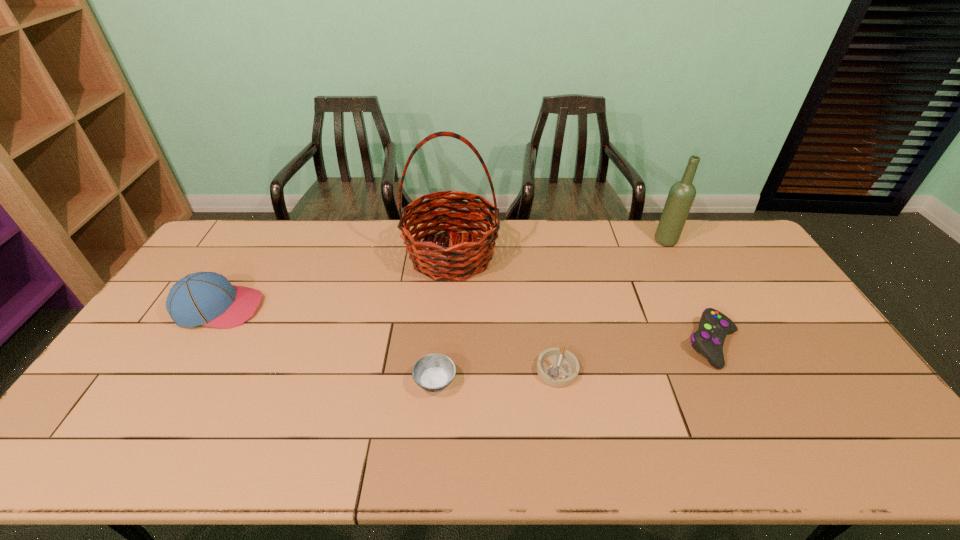
This screenshot has width=960, height=540. I want to click on free space located 0.170m on the front of the fifth shortest object, so click(686, 280).

In order to click on free space located 0.190m on the front-facing side of the fourth shortest object in this screenshot , I will do `click(323, 308)`.

The image size is (960, 540). In order to click on vacant space located on the right of the fourth tallest object in this screenshot , I will do `click(800, 344)`.

This screenshot has height=540, width=960. Identify the location of vacant area located on the back of the taller ashtray. (439, 345).

Find the location of a particular element. The width and height of the screenshot is (960, 540). free region located on the right of the right ashtray is located at coordinates (656, 370).

The width and height of the screenshot is (960, 540). In order to click on basket at the far edge in this screenshot , I will do `click(464, 258)`.

Find the location of a particular element. This screenshot has width=960, height=540. wine bottle situated at the far edge is located at coordinates (682, 194).

Identify the location of object that is at the left edge. (203, 298).

Locate an element on the screen. This screenshot has height=540, width=960. free location at the far edge of the desktop is located at coordinates (630, 221).

In the image, there is a desktop. At what (x,y) coordinates should I click in order to perform the action: click on free region at the near edge. Please return your answer as a coordinate pair (x, y). The width and height of the screenshot is (960, 540). Looking at the image, I should click on (702, 447).